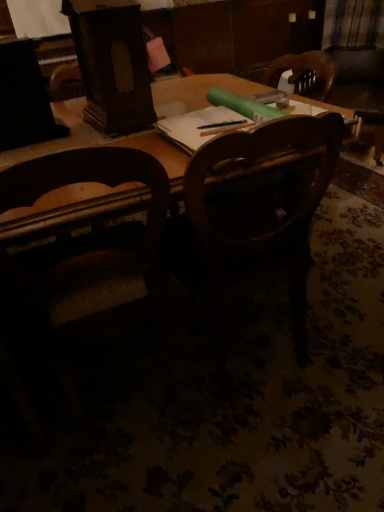
Question: Looking at their shapes, would you say wooden chair at left, the first chair positioned from the left, is wider or thinner than plaid fabric at upper right?

Choices:
 (A) wide
 (B) thin

Answer: (A)

Question: Considering the positions of point (84, 413) and point (374, 33), is point (84, 413) closer or farther from the camera than point (374, 33)?

Choices:
 (A) closer
 (B) farther

Answer: (A)

Question: Based on their relative distances, which object is farther from the plaid fabric at upper right?

Choices:
 (A) wooden chair at left, placed as the second chair when sorted from right to left
 (B) wooden chair at center, positioned as the first chair in right-to-left order

Answer: (A)

Question: Estimate the real-world distances between objects in this image. Which object is closer to the plaid fabric at upper right?

Choices:
 (A) wooden chair at left, the first chair positioned from the left
 (B) wooden chair at center, the second chair from the left

Answer: (B)